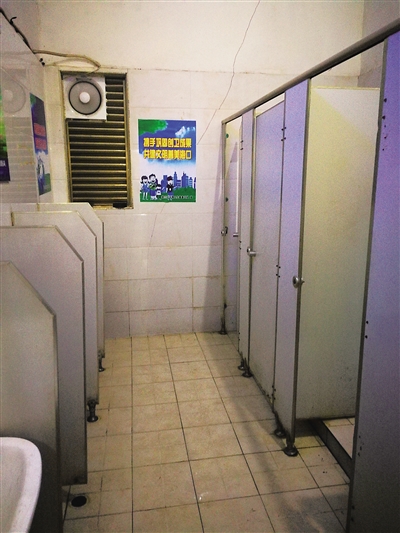
Identify the location of vent. (112, 166).